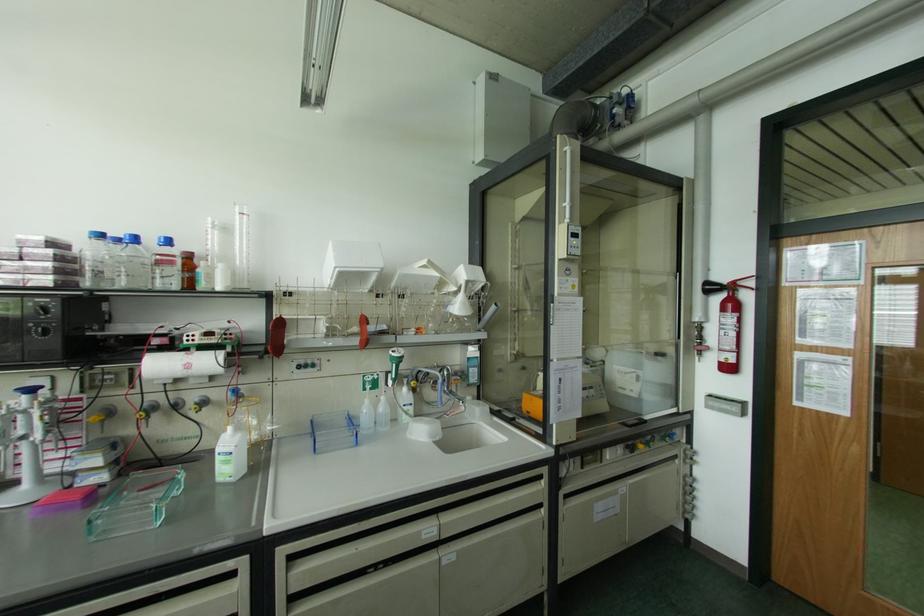
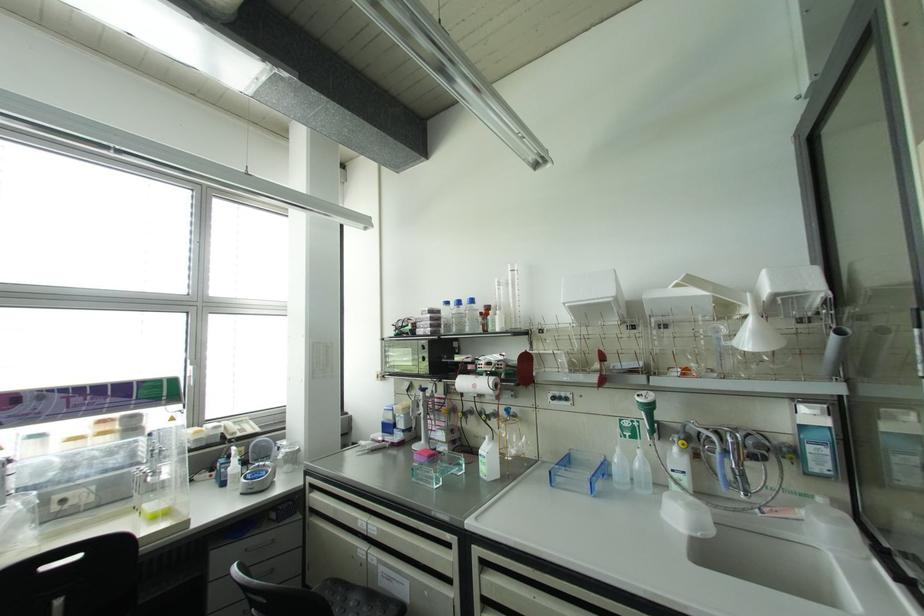
In the second image, find the point that corresponds to the point at 367,400 in the first image.

(616, 448)